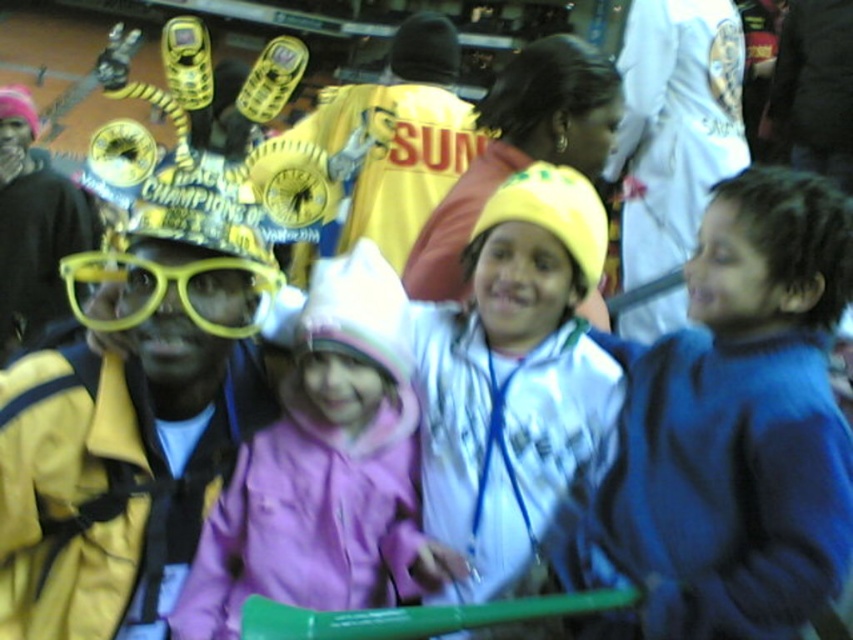
You are organizing a clothing donation drive and need to categorize jackets by size. You see a blue fleece jacket at right and a white matte jacket at center. Which jacket should you place in the small size bin?

The blue fleece jacket at right is smaller than the white matte jacket at center, so it should be placed in the small size bin.